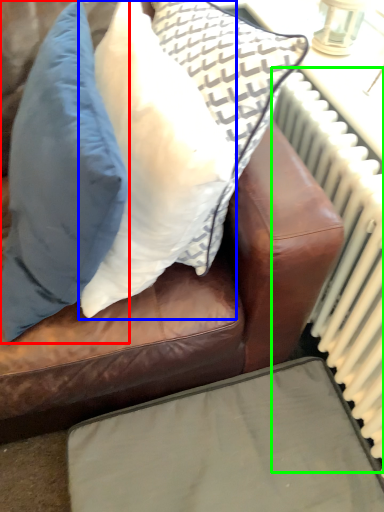
Question: Based on their relative distances, which object is farther from pillow (highlighted by a red box)? Choose from pillow (highlighted by a blue box) and radiator (highlighted by a green box).

Choices:
 (A) pillow
 (B) radiator

Answer: (B)